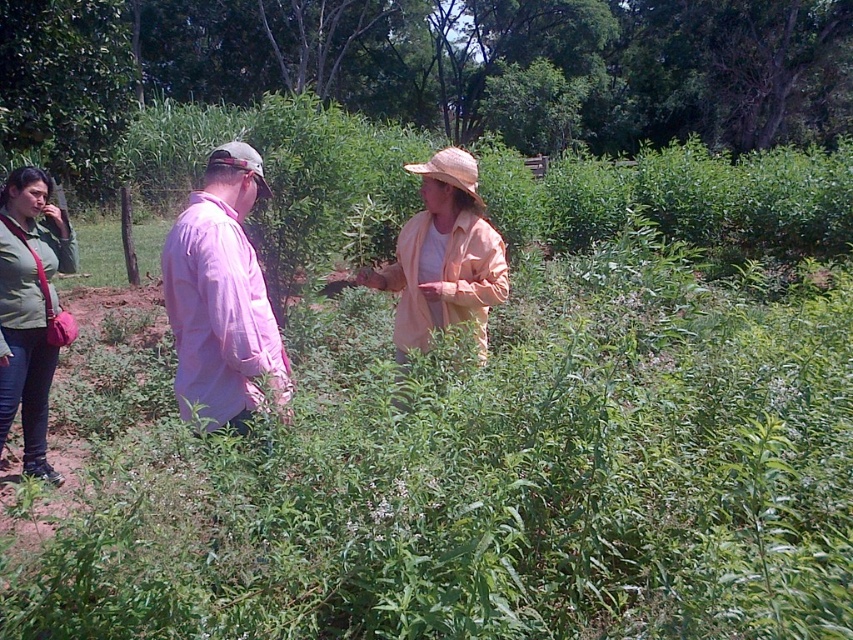
You are a photographer trying to capture a clear shot of the light peach fabric hat at center and the straw at center. Which object should you focus on first if you want to ensure both are in focus without moving the camera?

You should focus on the light peach fabric hat at center first because it is in front of the straw at center. By focusing on the closer object, you can ensure both are within the depth of field when using a small aperture.

You are planning to take a photo of the pink cotton shirt at center and the matte green jacket at lower left. Which object should you focus on first if you want to capture both in the frame without moving the camera?

You should focus on the pink cotton shirt at center first because it is wider than the matte green jacket at lower left, so keeping it centered will ensure both fit in the frame.

You are standing at the origin point in the image. There is a pink cotton shirt at center represented by point (221,296). Can you determine the direction you need to walk to reach the pink cotton shirt at center?

The pink cotton shirt at center is located at point (221,296), which is the center of the image. Therefore, you would need to walk straight ahead to reach it since it is at the center point.